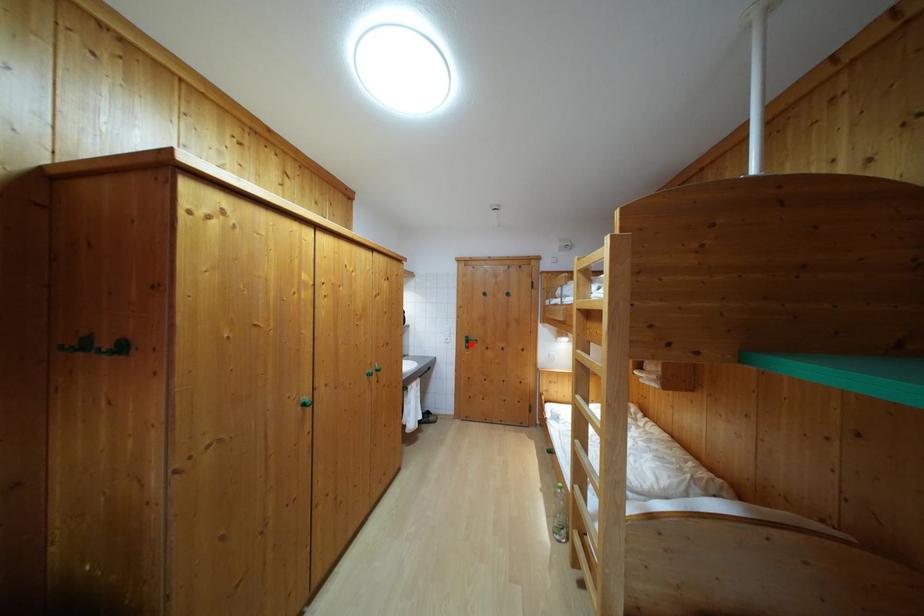
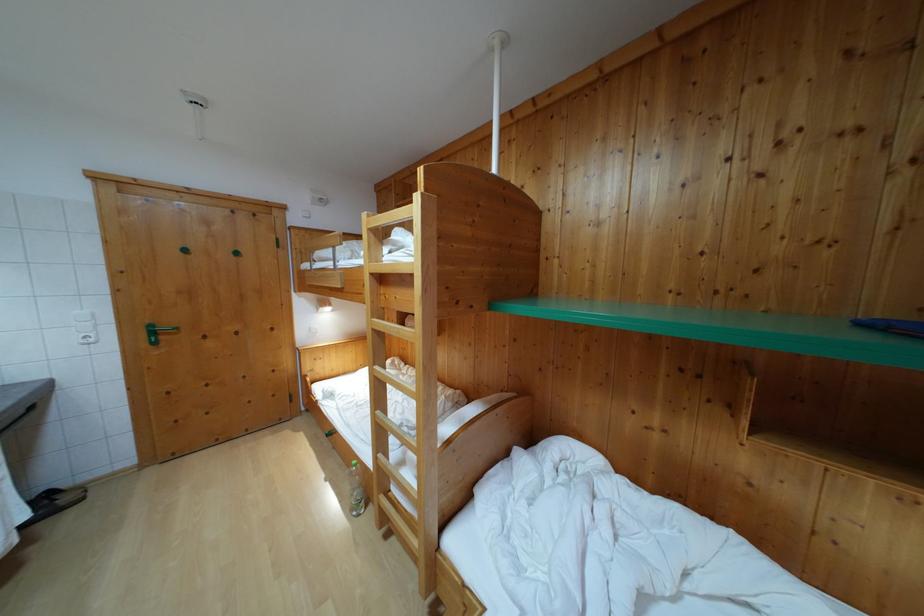
The point at the highlighted location is marked in the first image. Where is the corresponding point in the second image?

(155, 333)